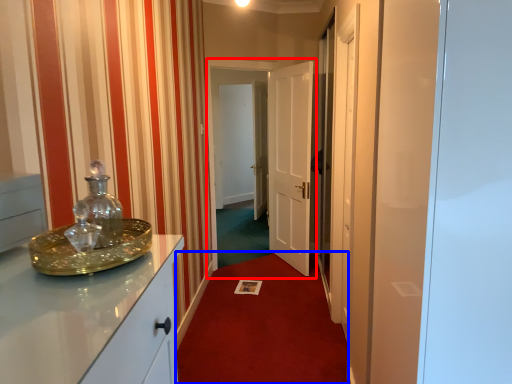
Question: Among these objects, which one is nearest to the camera, glass door (highlighted by a red box) or plain (highlighted by a blue box)?

Choices:
 (A) glass door
 (B) plain

Answer: (B)